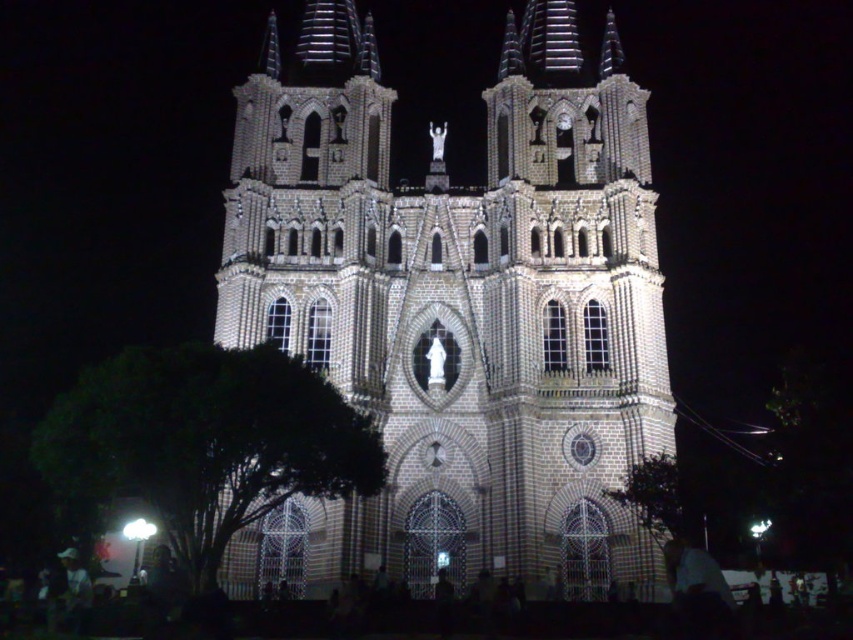
You are standing at the entrance of the church and want to take a photo of the statue on top of the central section. To avoid the green leafy tree at lower left from blocking the view, which direction should you move to ensure the tree is out of frame?

The green leafy tree at lower left is located at point (x=206, y=442). To avoid it blocking the view, move to the right or upwards to position yourself where the tree is no longer in the frame.

You are a photographer planning to take a wide shot of the brown textured stone church at center and the green leafy tree at lower right. Based on their sizes, which one should you focus on to ensure both are clearly visible in the frame?

The brown textured stone church at center is larger in size than the green leafy tree at lower right, so focusing on the church will ensure both are clearly visible as the tree will fit within the frame when the church is centered.